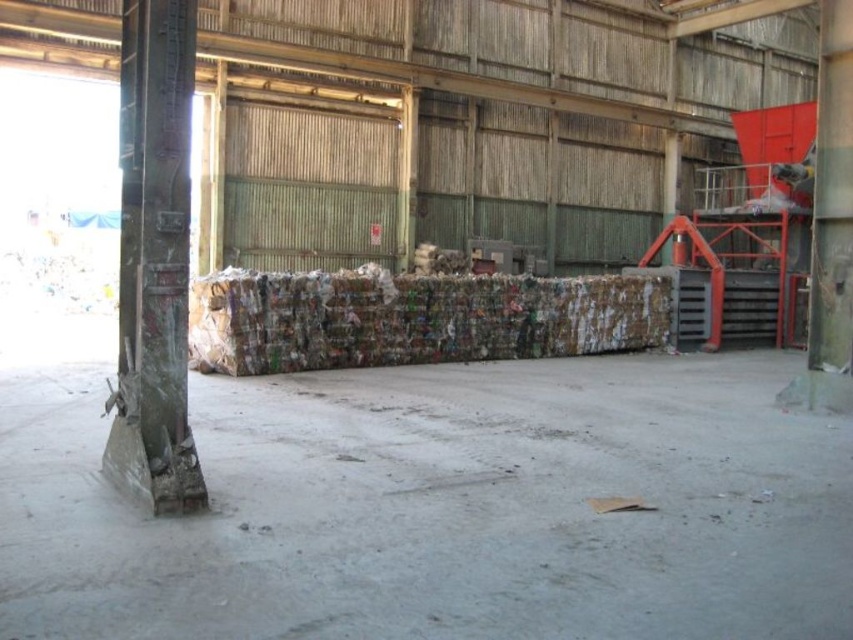
Question: Among these points, which one is farthest from the camera?

Choices:
 (A) (347, 324)
 (B) (161, 81)

Answer: (A)

Question: Where is brown cardboard bales at center located in relation to concrete textured pillar at left in the image?

Choices:
 (A) below
 (B) above

Answer: (A)

Question: Is brown cardboard bales at center closer to the viewer compared to concrete textured pillar at left?

Choices:
 (A) yes
 (B) no

Answer: (B)

Question: Does brown cardboard bales at center appear over concrete textured pillar at left?

Choices:
 (A) yes
 (B) no

Answer: (B)

Question: Which of the following is the closest to the observer?

Choices:
 (A) (155, 305)
 (B) (392, 321)

Answer: (A)